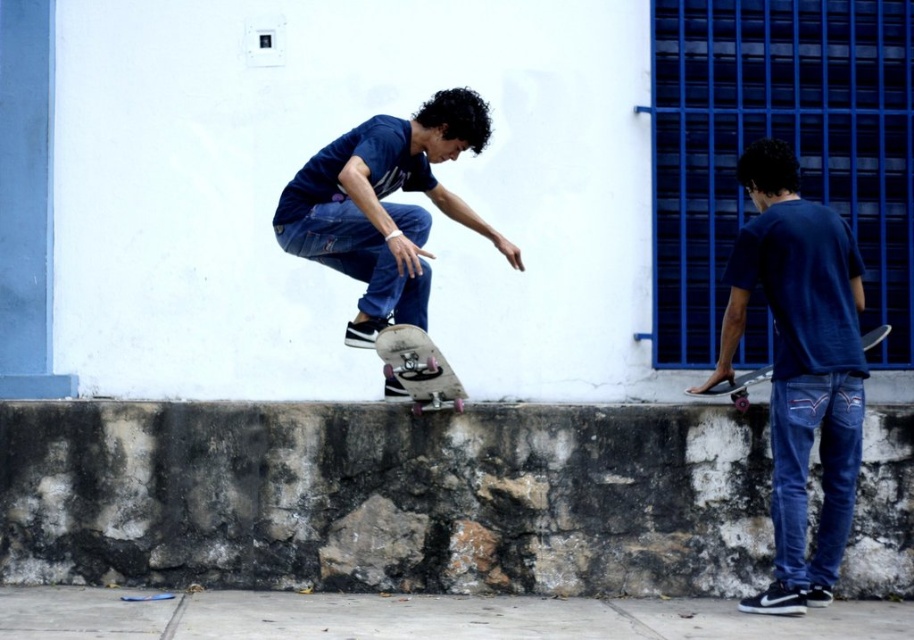
You are observing two objects in the skate park scene. The matte blue shirt at center and the white glossy skateboard at center. Which object is taller?

The matte blue shirt at center is taller than the white glossy skateboard at center.

You are a photographer standing at the origin point of the coordinate system. You want to capture the white glossy skateboard at center in your shot. According to the coordinates provided, where should you position your camera relative to the point marked at [418,369]?

The point marked at [418,369] directly corresponds to the location of the white glossy skateboard at center. Therefore, positioning the camera at this coordinate will ensure the skateboard is centered in the shot.